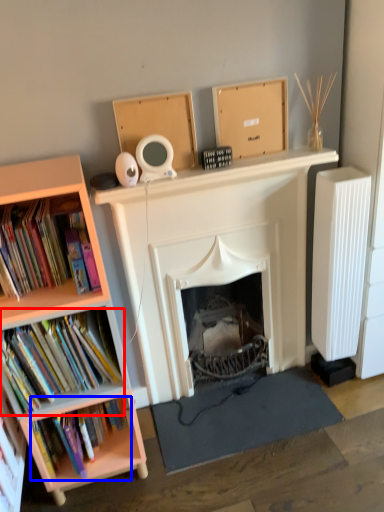
Question: Which object is closer to the camera taking this photo, book (highlighted by a red box) or book (highlighted by a blue box)?

Choices:
 (A) book
 (B) book

Answer: (A)